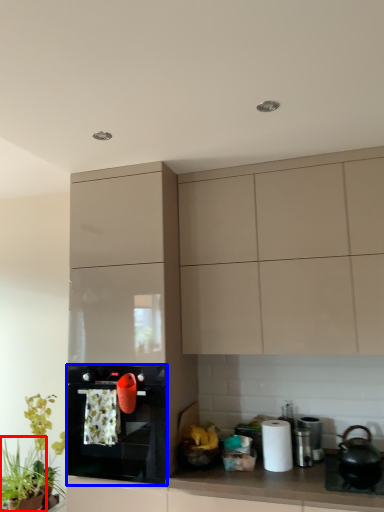
Question: Which object is closer to the camera taking this photo, plant (highlighted by a red box) or kitchen appliance (highlighted by a blue box)?

Choices:
 (A) plant
 (B) kitchen appliance

Answer: (B)